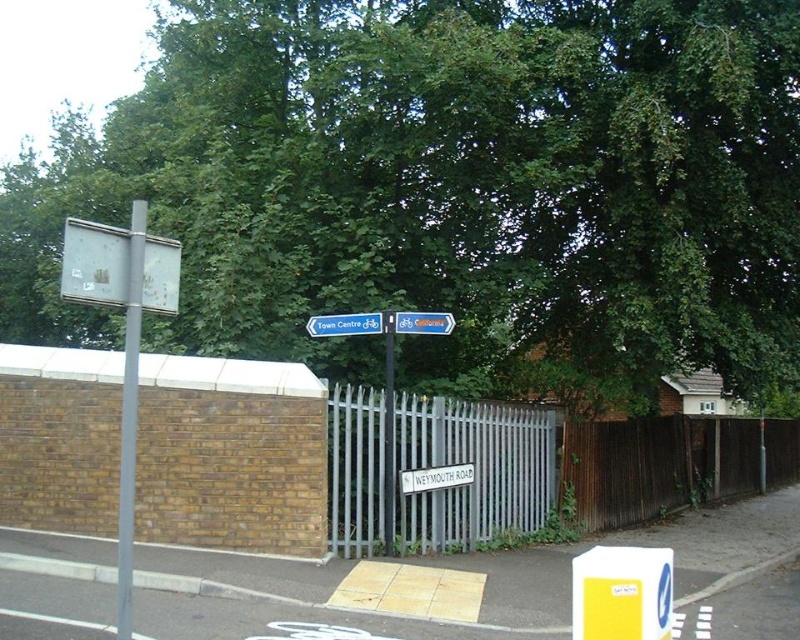
Is green leafy tree at upper center above blue plastic sign at upper center?

Correct, green leafy tree at upper center is located above blue plastic sign at upper center.

How far apart are green leafy tree at upper center and blue plastic sign at upper center?

green leafy tree at upper center is 14.56 feet from blue plastic sign at upper center.

Who is more distant from viewer, (425,156) or (328,333)?

Point (425,156)

Where is `green leafy tree at upper center`? green leafy tree at upper center is located at coordinates (449, 188).

Is silver metallic fence at center bigger than white plastic sign at upper left?

Yes.

How distant is silver metallic fence at center from white plastic sign at upper left?

The distance of silver metallic fence at center from white plastic sign at upper left is 17.75 feet.

Find the location of `silver metallic fence at center`. silver metallic fence at center is located at coordinates click(474, 470).

You are a GUI agent. You are given a task and a screenshot of the screen. Output one action in this format:
    pyautogui.click(x=<x>, y=<y>)
    Task: Click on the silver metallic fence at center
    The height and width of the screenshot is (640, 800).
    Given the screenshot: What is the action you would take?
    pyautogui.click(x=474, y=470)

Consider the image. Who is higher up, green leafy tree at upper center or metallic blue bicycle sign at center?

Positioned higher is green leafy tree at upper center.

I want to click on green leafy tree at upper center, so click(449, 188).